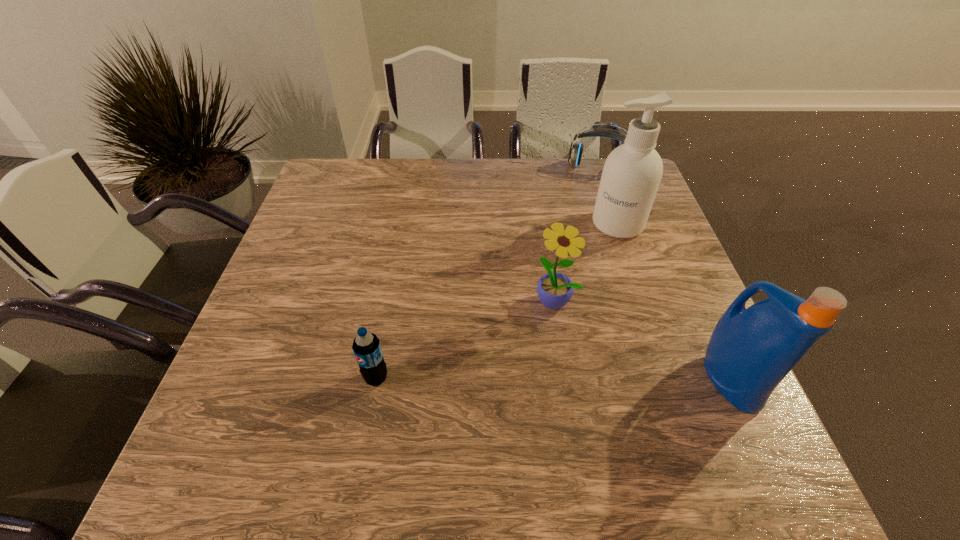
This screenshot has width=960, height=540. What are the coordinates of `vacant region at the near right corner of the desktop` in the screenshot? It's located at (707, 389).

What are the coordinates of `vacant point located between the soda bottle and the headset` in the screenshot? It's located at (488, 273).

You are a GUI agent. You are given a task and a screenshot of the screen. Output one action in this format:
    pyautogui.click(x=<x>, y=<y>)
    Task: Click on the free space between the detergent and the third tallest object
    
    Given the screenshot: What is the action you would take?
    pyautogui.click(x=642, y=340)

Find the location of a particular element. The width and height of the screenshot is (960, 540). free space between the leftmost object and the headset is located at coordinates (488, 273).

I want to click on vacant space that is in between the fourth nearest object and the soda bottle, so click(497, 301).

You are a GUI agent. You are given a task and a screenshot of the screen. Output one action in this format:
    pyautogui.click(x=<x>, y=<y>)
    Task: Click on the free space between the third tallest object and the soda bottle
    
    Given the screenshot: What is the action you would take?
    pyautogui.click(x=466, y=339)

You are a GUI agent. You are given a task and a screenshot of the screen. Output one action in this format:
    pyautogui.click(x=<x>, y=<y>)
    Task: Click on the vacant area that lies between the fourth nearest object and the third tallest object
    
    Given the screenshot: What is the action you would take?
    pyautogui.click(x=587, y=262)

What are the coordinates of `vacant space that is in between the tallest object and the second tallest object` in the screenshot? It's located at (674, 302).

Identify the location of vacant space that's between the detergent and the third farthest object. This screenshot has width=960, height=540. (642, 340).

Locate which object is the fourth closest to the fourth shortest object. Please provide its 2D coordinates. Your answer should be formatted as a tuple, i.e. [(x, y)], where the tuple contains the x and y coordinates of a point satisfying the conditions above.

[(366, 346)]